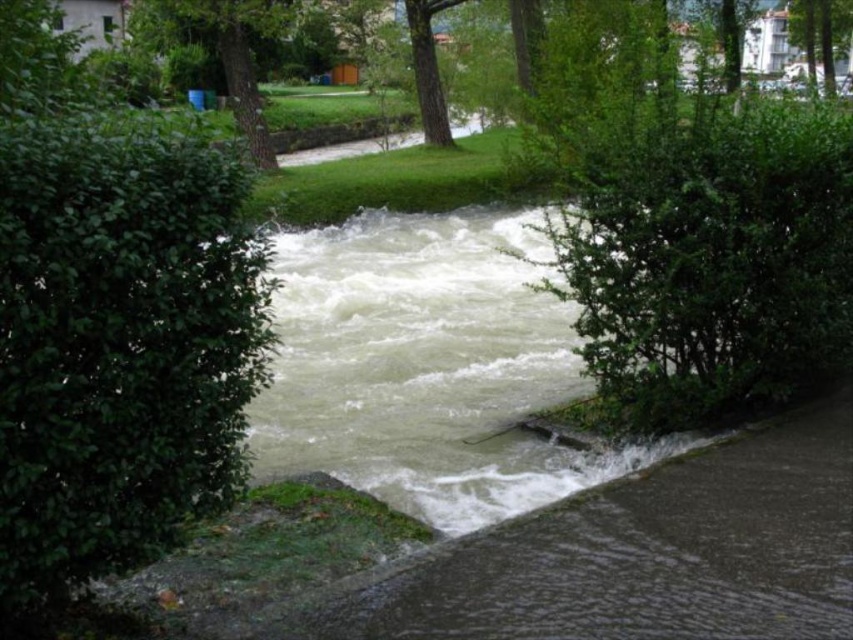
You are a hiker standing on the walkway near the river. You notice the green leafy hedge at left and the green leafy tree at center. Which one is closer to the ground?

The green leafy hedge at left is below the green leafy tree at center, so the hedge is closer to the ground than the tree.

You are standing on the walkway next to the river and want to take a photo of the green leafy hedge at left. Where should you position yourself to capture it in the frame?

The green leafy hedge at left is located at coordinates (119, 346) in the image, so you should position yourself facing that point to capture it in the frame.

You are a hiker trying to cross the river using the submerged path. You notice the green leafy hedge at left and the green leafy tree at upper center. Which of these two objects is closer to your current position on the path?

The green leafy hedge at left is closer to your current position on the path because it is positioned to the right of the green leafy tree at upper center. Since you are on the path near the riverbank, the hedge being to the right of the tree suggests it is nearer to your location.